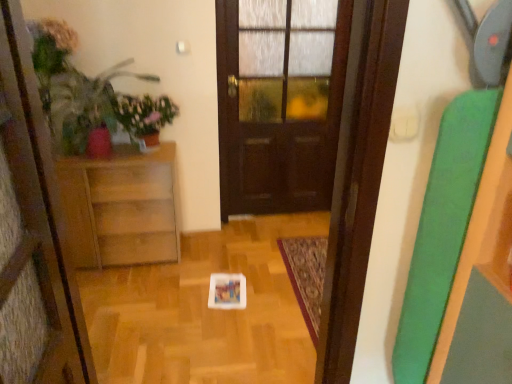
Question: From a real-world perspective, is matte green plant at left positioned under dark wood door at center based on gravity?

Choices:
 (A) no
 (B) yes

Answer: (A)

Question: Considering the relative sizes of matte green plant at left and dark wood door at center in the image provided, is matte green plant at left shorter than dark wood door at center?

Choices:
 (A) no
 (B) yes

Answer: (B)

Question: Considering the relative sizes of matte green plant at left and dark wood door at center in the image provided, is matte green plant at left smaller than dark wood door at center?

Choices:
 (A) yes
 (B) no

Answer: (A)

Question: Can we say matte green plant at left lies outside dark wood door at center?

Choices:
 (A) yes
 (B) no

Answer: (A)

Question: Considering the relative sizes of matte green plant at left and dark wood door at center in the image provided, is matte green plant at left bigger than dark wood door at center?

Choices:
 (A) no
 (B) yes

Answer: (A)

Question: Is matte green plant at left far away from dark wood door at center?

Choices:
 (A) yes
 (B) no

Answer: (B)

Question: Is matte green plant at left facing towards green matte plant at upper left?

Choices:
 (A) no
 (B) yes

Answer: (B)

Question: Is matte green plant at left looking in the opposite direction of green matte plant at upper left?

Choices:
 (A) yes
 (B) no

Answer: (A)

Question: From the image's perspective, is matte green plant at left above green matte plant at upper left?

Choices:
 (A) no
 (B) yes

Answer: (A)

Question: Would you say matte green plant at left is outside green matte plant at upper left?

Choices:
 (A) no
 (B) yes

Answer: (B)

Question: Is matte green plant at left to the right of green matte plant at upper left from the viewer's perspective?

Choices:
 (A) no
 (B) yes

Answer: (A)

Question: Are matte green plant at left and green matte plant at upper left making contact?

Choices:
 (A) no
 (B) yes

Answer: (A)

Question: From a real-world perspective, is matte green plant at left over wooden cabinet at left?

Choices:
 (A) no
 (B) yes

Answer: (B)